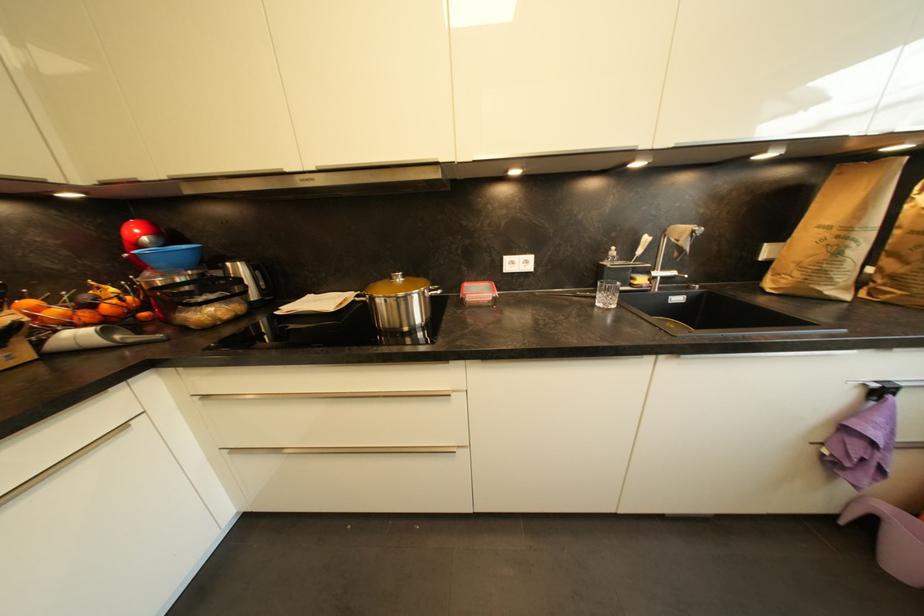
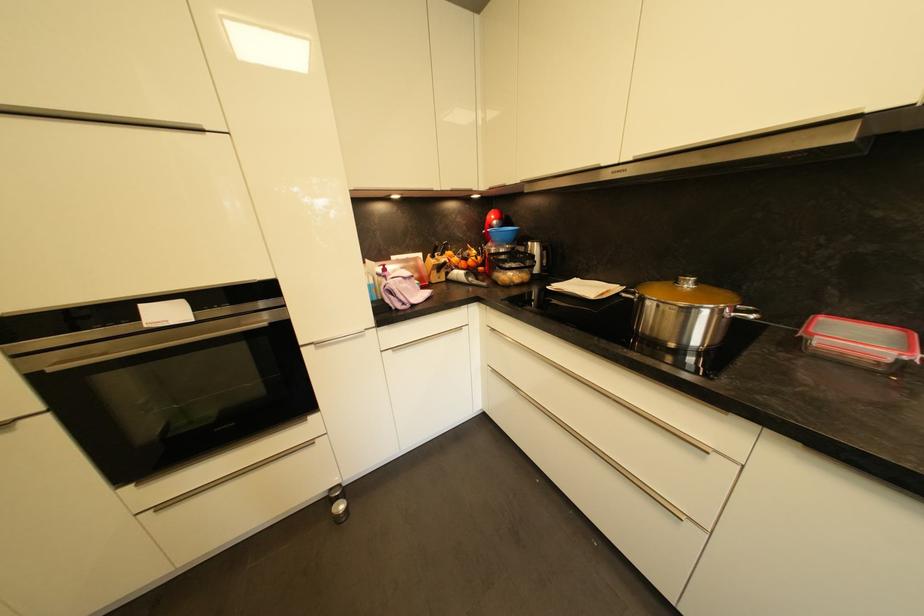
Locate, in the second image, the point that corresponds to [143,334] in the first image.

(481, 281)